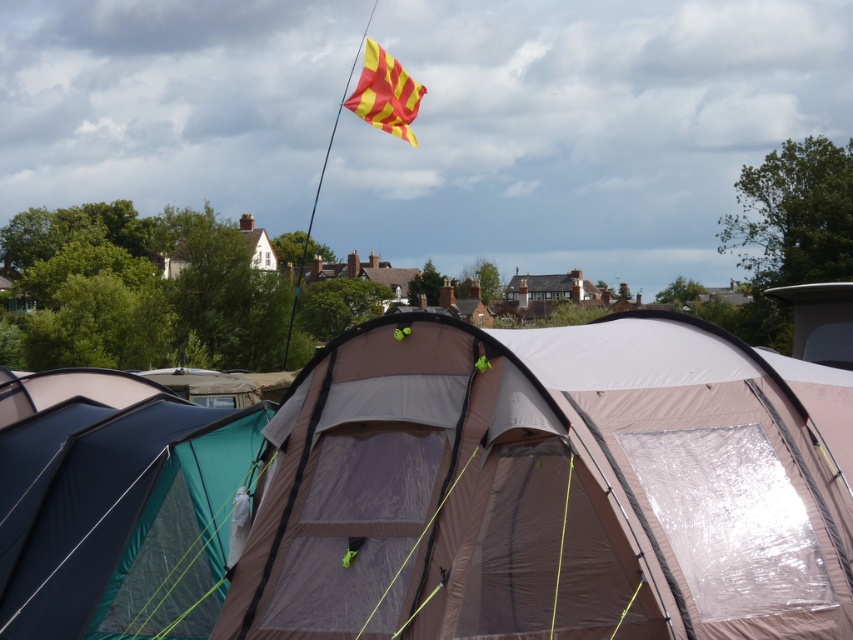
Between matte brown tent at center and teal fabric tent at lower left, which one has more height?

Standing taller between the two is matte brown tent at center.

Who is positioned more to the right, matte brown tent at center or teal fabric tent at lower left?

matte brown tent at center is more to the right.

Between point (612, 577) and point (148, 428), which one is positioned behind?

The point (148, 428) is behind.

I want to click on matte brown tent at center, so click(549, 488).

Is teal fabric tent at lower left to the right of yellowmaterial/texture flag at upper center from the viewer's perspective?

Incorrect, teal fabric tent at lower left is not on the right side of yellowmaterial/texture flag at upper center.

Which is in front, point (148, 552) or point (416, 86)?

Point (148, 552) is more forward.

Image resolution: width=853 pixels, height=640 pixels. Identify the location of teal fabric tent at lower left. (120, 518).

What do you see at coordinates (549, 488) in the screenshot? I see `matte brown tent at center` at bounding box center [549, 488].

Is matte brown tent at center to the left of yellowmaterial/texture flag at upper center from the viewer's perspective?

No, matte brown tent at center is not to the left of yellowmaterial/texture flag at upper center.

Find the location of a particular element. matte brown tent at center is located at coordinates (549, 488).

I want to click on matte brown tent at center, so click(x=549, y=488).